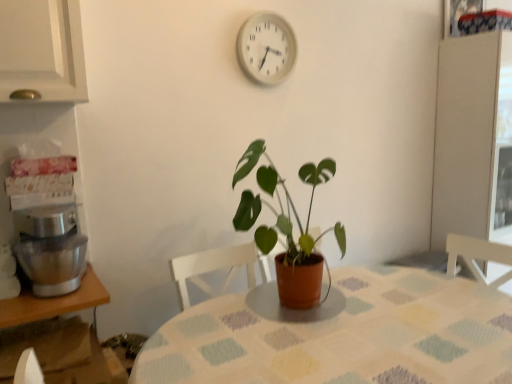
Question: Considering the positions of wooden table at lower left, which appears as the 1th table when viewed from the left, and green matte plant at center in the image, is wooden table at lower left, which appears as the 1th table when viewed from the left, bigger or smaller than green matte plant at center?

Choices:
 (A) big
 (B) small

Answer: (B)

Question: From the image's perspective, relative to green matte plant at center, is wooden table at lower left, placed as the 2th table when sorted from right to left, above or below?

Choices:
 (A) above
 (B) below

Answer: (B)

Question: Considering the real-world distances, which object is farthest from the silver metallic mixer at left?

Choices:
 (A) white plastic clock at upper center
 (B) green matte plant at center
 (C) textured fabric table at center, which appears as the first table when viewed from the right
 (D) wooden table at lower left, which appears as the 1th table when viewed from the left

Answer: (A)

Question: Which of these objects is positioned closest to the wooden table at lower left, placed as the 2th table when sorted from right to left?

Choices:
 (A) green matte plant at center
 (B) textured fabric table at center, which appears as the first table when viewed from the right
 (C) silver metallic mixer at left
 (D) white plastic clock at upper center

Answer: (C)